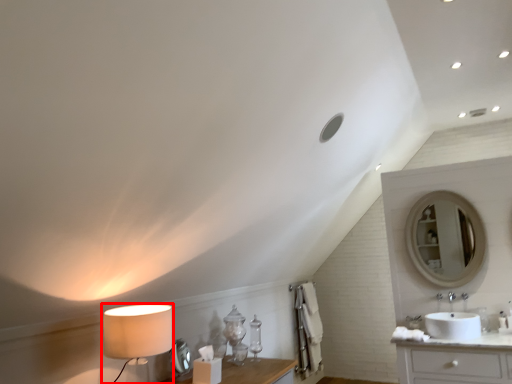
Question: From the image's perspective, where is table lamp (annotated by the red box) located in relation to sink in the image?

Choices:
 (A) above
 (B) below

Answer: (A)